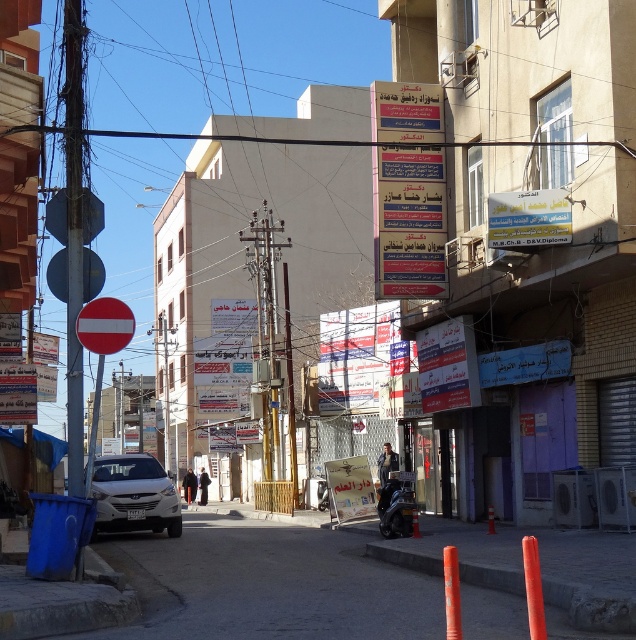
You are standing at the entrance of the street and want to park your white matte car at center. The parking spot is located at point (134, 496). Is there any object at that location?

Yes, there is a white matte car at center located at point (134, 496).

You are a delivery driver who needs to park your white matte car at center in front of the blue paper sign at center. Can you park your car so that it is directly in front of the sign?

The blue paper sign at center is to the right of the white matte car at center, so the car cannot be parked directly in front of the sign because the sign is positioned to the right side of the car.